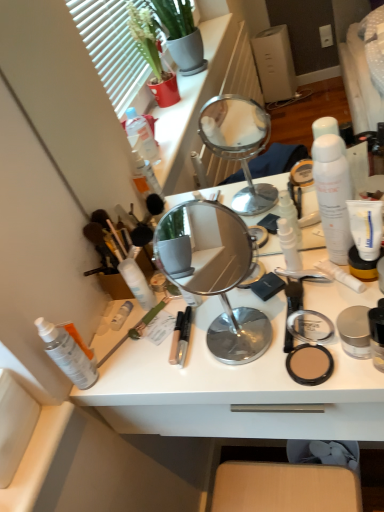
This screenshot has width=384, height=512. Find the location of `vacant area that lies in front of green matte brush at center`. vacant area that lies in front of green matte brush at center is located at coordinates (153, 372).